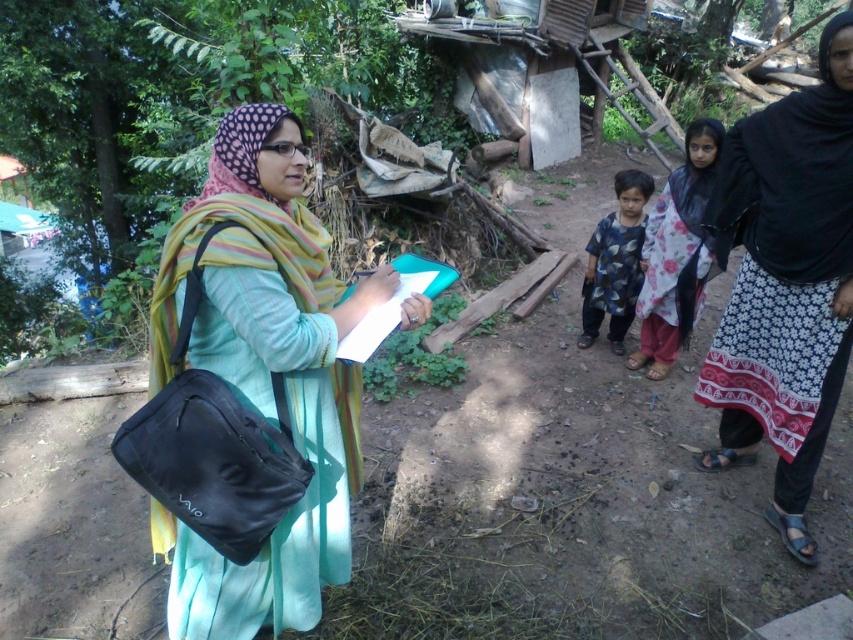
Question: Which point is closer to the camera?

Choices:
 (A) black printed skirt at lower right
 (B) matte black bag at left

Answer: (B)

Question: Which object appears closest to the camera in this image?

Choices:
 (A) floral fabric hijab at center
 (B) matte black bag at left

Answer: (B)

Question: Is matte black bag at left closer to camera compared to blue printed shirt at center?

Choices:
 (A) no
 (B) yes

Answer: (B)

Question: Which is farther from the matte black bag at left?

Choices:
 (A) blue printed shirt at center
 (B) floral fabric hijab at center

Answer: (A)

Question: Does black printed skirt at lower right appear on the left side of blue printed shirt at center?

Choices:
 (A) no
 (B) yes

Answer: (A)

Question: Can you confirm if matte black bag at left is bigger than floral fabric hijab at center?

Choices:
 (A) yes
 (B) no

Answer: (A)